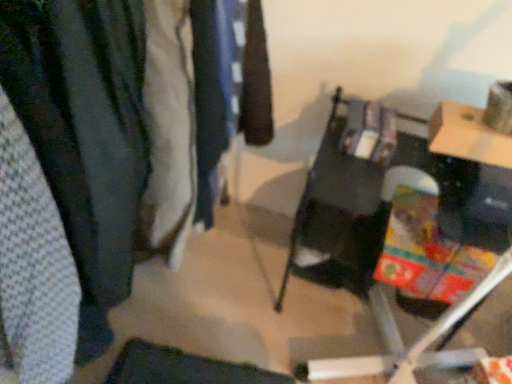
Question: Does matte black table at center have a larger size compared to textured fabric closet at left?

Choices:
 (A) yes
 (B) no

Answer: (A)

Question: Is matte black table at center turned away from textured fabric closet at left?

Choices:
 (A) yes
 (B) no

Answer: (B)

Question: From a real-world perspective, is matte black table at center under textured fabric closet at left?

Choices:
 (A) no
 (B) yes

Answer: (B)

Question: Can we say matte black table at center lies outside textured fabric closet at left?

Choices:
 (A) no
 (B) yes

Answer: (B)

Question: From the image's perspective, is matte black table at center under textured fabric closet at left?

Choices:
 (A) no
 (B) yes

Answer: (B)

Question: Is white textured fabric at left, which is the 2th clothing in back-to-front order, in front of or behind textured fabric closet at left in the image?

Choices:
 (A) front
 (B) behind

Answer: (A)

Question: From the image's perspective, is white textured fabric at left, the first clothing viewed from the left, located above or below textured fabric closet at left?

Choices:
 (A) below
 (B) above

Answer: (A)

Question: In terms of size, does white textured fabric at left, marked as the second clothing in a right-to-left arrangement, appear bigger or smaller than textured fabric closet at left?

Choices:
 (A) big
 (B) small

Answer: (B)

Question: Is white textured fabric at left, marked as the second clothing in a right-to-left arrangement, situated inside textured fabric closet at left or outside?

Choices:
 (A) outside
 (B) inside

Answer: (A)

Question: Looking at their shapes, would you say dark blue fabric at center, arranged as the second clothing when viewed from the left, is wider or thinner than white textured fabric at left, which is the 2th clothing in back-to-front order?

Choices:
 (A) thin
 (B) wide

Answer: (A)

Question: Is dark blue fabric at center, acting as the 1th clothing starting from the right, bigger or smaller than white textured fabric at left, marked as the second clothing in a right-to-left arrangement?

Choices:
 (A) big
 (B) small

Answer: (B)

Question: From a real-world perspective, is dark blue fabric at center, which is the 1th clothing from back to front, above or below white textured fabric at left, which is the 2th clothing in back-to-front order?

Choices:
 (A) above
 (B) below

Answer: (B)

Question: Would you say dark blue fabric at center, which is the 1th clothing from back to front, is to the left or to the right of white textured fabric at left, which is the 1th clothing in front-to-back order, in the picture?

Choices:
 (A) right
 (B) left

Answer: (A)

Question: Do you think matte black table at center is within dark blue fabric at center, which ranks as the second clothing in front-to-back order, or outside of it?

Choices:
 (A) outside
 (B) inside

Answer: (A)

Question: From the image's perspective, is matte black table at center above or below dark blue fabric at center, acting as the 1th clothing starting from the right?

Choices:
 (A) above
 (B) below

Answer: (B)